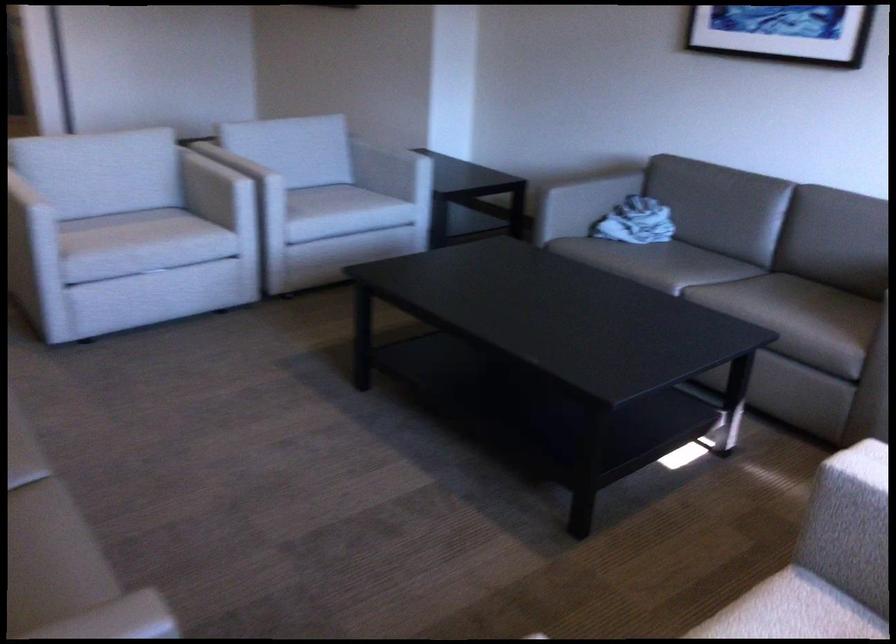
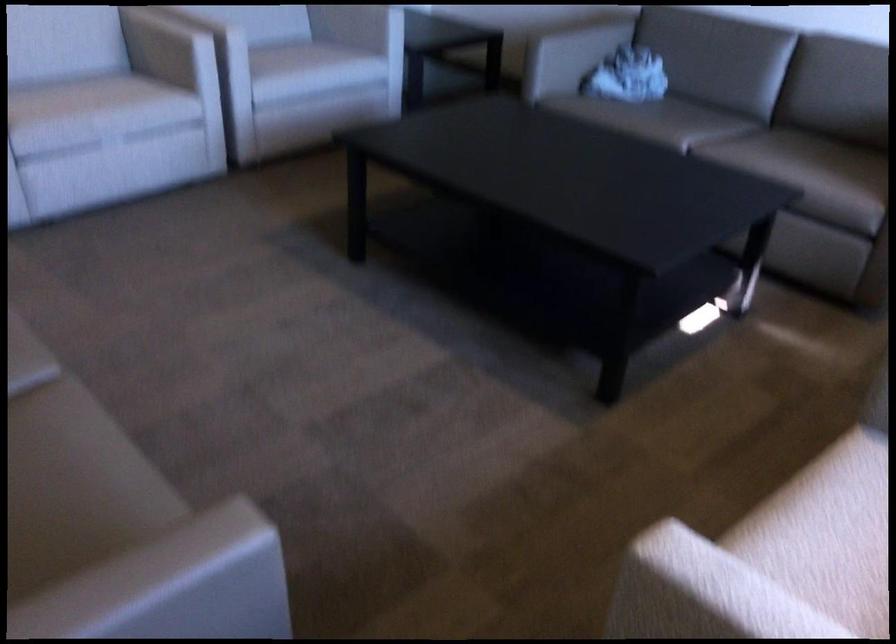
The point at (343, 234) is marked in the first image. Where is the corresponding point in the second image?

(314, 91)